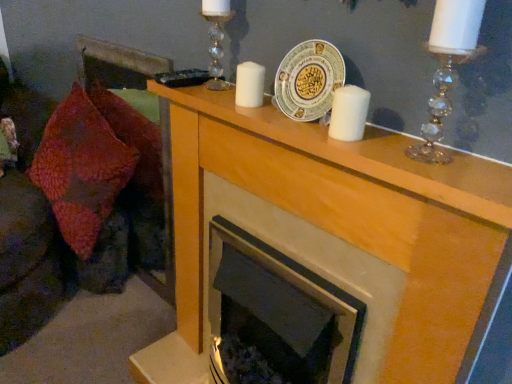
What is the approximate width of clear crystal candle holder at upper right, positioned as the second candle holder in left-to-right order?

8.13 centimeters.

What do you see at coordinates (334, 231) in the screenshot?
I see `wooden mantlepiece at upper center` at bounding box center [334, 231].

The width and height of the screenshot is (512, 384). What are the coordinates of `clear crystal candle holder at upper center, acting as the 1th candle holder starting from the back` in the screenshot? It's located at (216, 39).

Image resolution: width=512 pixels, height=384 pixels. I want to click on clear crystal candle holder at upper right, which is counted as the 1th candle holder, starting from the front, so click(x=447, y=68).

Is point (333, 194) closer or farther from the camera than point (338, 121)?

Point (333, 194) is farther from the camera than point (338, 121).

Is wooden mantlepiece at upper center in contact with white matte candle at center, the first candle ordered from the bottom?

No.

From a real-world perspective, which object stands above the other?

From a 3D spatial view, white matte candle at center, the first candle ordered from the bottom, is above.

Consider the image. Who is more distant, white matte candle at center, which ranks as the 2th candle in top-to-bottom order, or clear crystal candle holder at upper right, which is the 1th candle holder in right-to-left order?

white matte candle at center, which ranks as the 2th candle in top-to-bottom order, is further away from the camera.

From a real-world perspective, is white matte candle at center, the 2th candle positioned from the left, physically below clear crystal candle holder at upper right, which is the 1th candle holder in right-to-left order?

Yes, from a real-world perspective, white matte candle at center, the 2th candle positioned from the left, is below clear crystal candle holder at upper right, which is the 1th candle holder in right-to-left order.

Is clear crystal candle holder at upper right, which is counted as the 1th candle holder, starting from the front, at the back of white matte candle at center, positioned as the 2th candle in back-to-front order?

No, white matte candle at center, positioned as the 2th candle in back-to-front order, is not facing away from clear crystal candle holder at upper right, which is counted as the 1th candle holder, starting from the front.

Which object is closer to the camera taking this photo, wooden mantlepiece at upper center or clear crystal candle holder at upper center, the 2th candle holder in the right-to-left sequence?

wooden mantlepiece at upper center is in front.

How much distance is there between wooden mantlepiece at upper center and clear crystal candle holder at upper center, acting as the 1th candle holder starting from the back?

38.47 centimeters.

From the picture: Is wooden mantlepiece at upper center bigger than clear crystal candle holder at upper center, the second candle holder viewed from the front?

Correct, wooden mantlepiece at upper center is larger in size than clear crystal candle holder at upper center, the second candle holder viewed from the front.

Could you tell me if wooden mantlepiece at upper center is facing clear crystal candle holder at upper center, acting as the 1th candle holder starting from the back?

No, wooden mantlepiece at upper center does not turn towards clear crystal candle holder at upper center, acting as the 1th candle holder starting from the back.

Can you confirm if clear crystal candle holder at upper center, acting as the 1th candle holder starting from the back, is taller than white ceramic plate at center?

Yes, clear crystal candle holder at upper center, acting as the 1th candle holder starting from the back, is taller than white ceramic plate at center.

Is clear crystal candle holder at upper center, the first candle holder from the left, inside or outside of white ceramic plate at center?

clear crystal candle holder at upper center, the first candle holder from the left, cannot be found inside white ceramic plate at center.

Is clear crystal candle holder at upper center, the first candle holder from the left, with white ceramic plate at center?

clear crystal candle holder at upper center, the first candle holder from the left, and white ceramic plate at center are clearly separated.

I want to click on candle holder behind the white ceramic plate at center, so click(x=216, y=39).

In the scene shown: In terms of size, does white matte candle at center, which is counted as the second candle, starting from the right, appear bigger or smaller than clear crystal candle holder at upper right, which is counted as the 1th candle holder, starting from the front?

white matte candle at center, which is counted as the second candle, starting from the right, is smaller than clear crystal candle holder at upper right, which is counted as the 1th candle holder, starting from the front.

Is white matte candle at center, which is counted as the second candle, starting from the right, facing towards clear crystal candle holder at upper right, positioned as the second candle holder in left-to-right order?

No.

Is white matte candle at center, which is the second candle in bottom-to-top order, in front of or behind clear crystal candle holder at upper right, positioned as the second candle holder in left-to-right order, in the image?

Visually, white matte candle at center, which is the second candle in bottom-to-top order, is located behind clear crystal candle holder at upper right, positioned as the second candle holder in left-to-right order.

From the image's perspective, which one is positioned lower, white matte candle at center, which is the second candle in bottom-to-top order, or clear crystal candle holder at upper right, which is the 1th candle holder in right-to-left order?

clear crystal candle holder at upper right, which is the 1th candle holder in right-to-left order, appears lower in the image.

Considering the relative sizes of white matte candle at center, the first candle ordered from the bottom, and white matte candle at center, which ranks as the first candle in top-to-bottom order, in the image provided, is white matte candle at center, the first candle ordered from the bottom, shorter than white matte candle at center, which ranks as the first candle in top-to-bottom order,?

No, white matte candle at center, the first candle ordered from the bottom, is not shorter than white matte candle at center, which ranks as the first candle in top-to-bottom order.

Is white matte candle at center, which ranks as the 2th candle in top-to-bottom order, not near white matte candle at center, which ranks as the first candle in top-to-bottom order?

white matte candle at center, which ranks as the 2th candle in top-to-bottom order, is actually quite close to white matte candle at center, which ranks as the first candle in top-to-bottom order.

In the scene shown: How far apart are white matte candle at center, positioned as the first candle in right-to-left order, and white matte candle at center, which is the second candle in bottom-to-top order?

10.05 inches.

Between white matte candle at center, positioned as the 2th candle in back-to-front order, and white matte candle at center, which is the first candle in left-to-right order, which one is positioned in front?

white matte candle at center, positioned as the 2th candle in back-to-front order, is closer to the camera.

Is the depth of clear crystal candle holder at upper center, the first candle holder from the left, less than that of velvet textured throw pillow at left?

Yes.

Considering the sizes of objects clear crystal candle holder at upper center, the 2th candle holder in the right-to-left sequence, and velvet textured throw pillow at left in the image provided, who is shorter, clear crystal candle holder at upper center, the 2th candle holder in the right-to-left sequence, or velvet textured throw pillow at left?

Standing shorter between the two is clear crystal candle holder at upper center, the 2th candle holder in the right-to-left sequence.

Can you confirm if clear crystal candle holder at upper center, the second candle holder viewed from the front, is wider than velvet textured throw pillow at left?

No.

Where is `cabinetry below the white matte candle at center, which ranks as the 2th candle in top-to-bottom order (from a real-world perspective)`? This screenshot has height=384, width=512. cabinetry below the white matte candle at center, which ranks as the 2th candle in top-to-bottom order (from a real-world perspective) is located at coordinates (334, 231).

Locate an element on the screen. the 1st candle holder above the white matte candle at center, which ranks as the 2th candle in top-to-bottom order (from the image's perspective) is located at coordinates (447, 68).

Looking at the image, which one is located further to clear crystal candle holder at upper right, positioned as the second candle holder in left-to-right order, white matte candle at center, the first candle ordered from the bottom, or white ceramic plate at center?

Among the two, white ceramic plate at center is located further to clear crystal candle holder at upper right, positioned as the second candle holder in left-to-right order.

Estimate the real-world distances between objects in this image. Which object is further from white matte candle at center, positioned as the 2th candle in back-to-front order, clear crystal candle holder at upper center, the second candle holder viewed from the front, or white matte candle at center, the second candle viewed from the front?

clear crystal candle holder at upper center, the second candle holder viewed from the front, is further to white matte candle at center, positioned as the 2th candle in back-to-front order.

Estimate the real-world distances between objects in this image. Which object is further from velvet textured throw pillow at left, clear crystal candle holder at upper right, which is the 1th candle holder in right-to-left order, or clear crystal candle holder at upper center, the second candle holder viewed from the front?

clear crystal candle holder at upper right, which is the 1th candle holder in right-to-left order, is positioned further to the anchor velvet textured throw pillow at left.

Estimate the real-world distances between objects in this image. Which object is further from white matte candle at center, which is the first candle in left-to-right order, white matte candle at center, the 2th candle positioned from the left, or white ceramic plate at center?

Among the two, white matte candle at center, the 2th candle positioned from the left, is located further to white matte candle at center, which is the first candle in left-to-right order.

When comparing their distances from white matte candle at center, which ranks as the 2th candle in top-to-bottom order, does clear crystal candle holder at upper center, the first candle holder from the left, or white ceramic plate at center seem further?

clear crystal candle holder at upper center, the first candle holder from the left, is further to white matte candle at center, which ranks as the 2th candle in top-to-bottom order.

Based on their spatial positions, is white ceramic plate at center or white matte candle at center, which ranks as the first candle in top-to-bottom order, closer to clear crystal candle holder at upper right, which is counted as the 1th candle holder, starting from the front?

white ceramic plate at center is closer to clear crystal candle holder at upper right, which is counted as the 1th candle holder, starting from the front.

When comparing their distances from white matte candle at center, the 2th candle positioned from the left, does white ceramic plate at center or clear crystal candle holder at upper right, which is the 1th candle holder in right-to-left order, seem closer?

Among the two, white ceramic plate at center is located nearer to white matte candle at center, the 2th candle positioned from the left.

Which object lies further to the anchor point clear crystal candle holder at upper right, which is counted as the 1th candle holder, starting from the front, white matte candle at center, which ranks as the first candle in top-to-bottom order, or white matte candle at center, the 2th candle positioned from the left?

white matte candle at center, which ranks as the first candle in top-to-bottom order.

You are a GUI agent. You are given a task and a screenshot of the screen. Output one action in this format:
    pyautogui.click(x=<x>, y=<y>)
    Task: Click on the candle between white matte candle at center, the second candle viewed from the front, and wooden mantlepiece at upper center vertically
    The image size is (512, 384).
    Given the screenshot: What is the action you would take?
    pyautogui.click(x=349, y=113)

The width and height of the screenshot is (512, 384). In order to click on candle holder between velvet textured throw pillow at left and clear crystal candle holder at upper right, which is counted as the 1th candle holder, starting from the front, from left to right in this screenshot , I will do `click(216, 39)`.

Where is `candle between clear crystal candle holder at upper right, which is the 1th candle holder in right-to-left order, and white matte candle at center, which is the first candle in left-to-right order, from front to back`? The image size is (512, 384). candle between clear crystal candle holder at upper right, which is the 1th candle holder in right-to-left order, and white matte candle at center, which is the first candle in left-to-right order, from front to back is located at coordinates (349, 113).

Find the location of a particular element. The image size is (512, 384). candle that lies between clear crystal candle holder at upper center, the first candle holder from the left, and white ceramic plate at center from top to bottom is located at coordinates (249, 85).